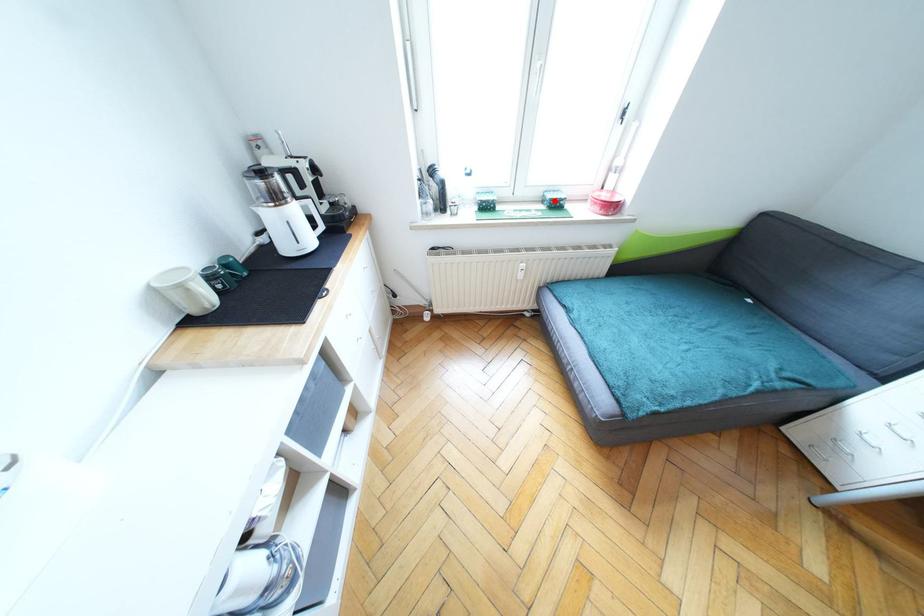
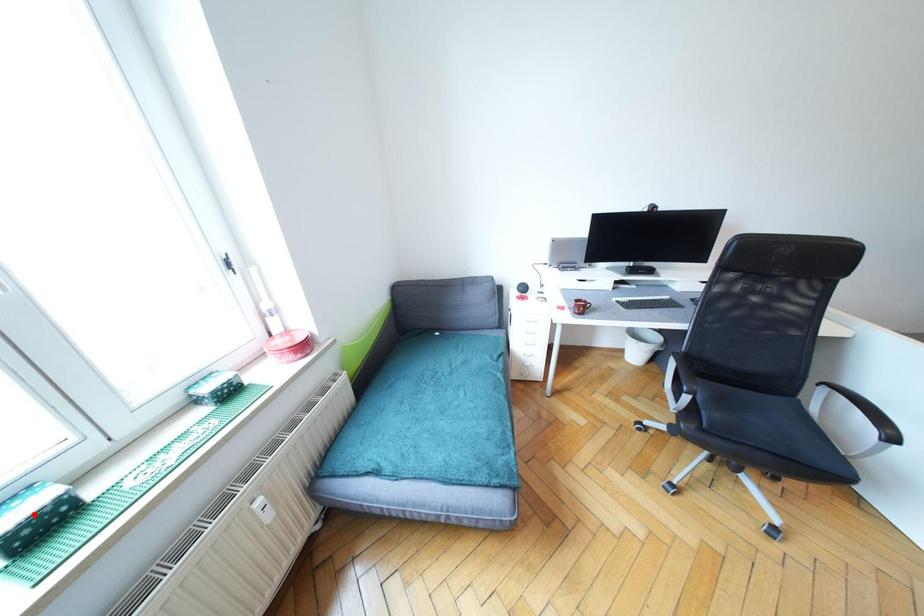
I am providing you with two images of the same scene from different viewpoints. A red point is marked on the first image and another point is marked on the second image. Does the point marked in image1 correspond to the same location as the one in image2?

No